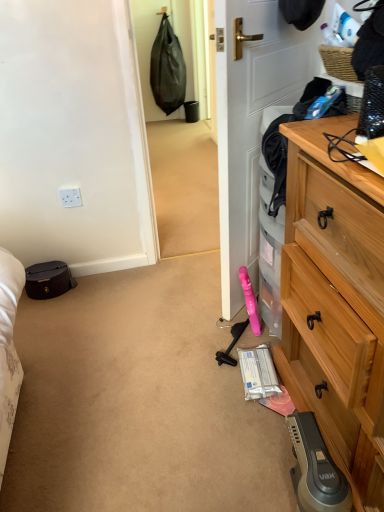
You are a GUI agent. You are given a task and a screenshot of the screen. Output one action in this format:
    pyautogui.click(x=<x>, y=<y>)
    Task: Click on the vacant space to the left of white matte door at center
    This screenshot has height=512, width=384.
    Given the screenshot: What is the action you would take?
    pyautogui.click(x=163, y=297)